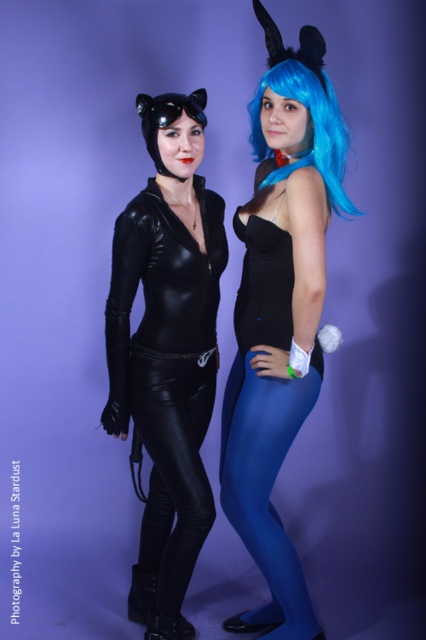
Please look at the image and identify the object located at coordinates point (170, 477). Which object is it?

The object located at point (170, 477) is the black leather pants at lower center.

You are a costume designer trying to fit a new accessory between the matte black bodysuit at center and the black leather pants at lower center. Based on their widths, can you place the accessory between them without overlapping either?

The matte black bodysuit at center might be wider than black leather pants at lower center, so there may not be enough space to place the accessory between them without overlapping. Check the exact measurements first.